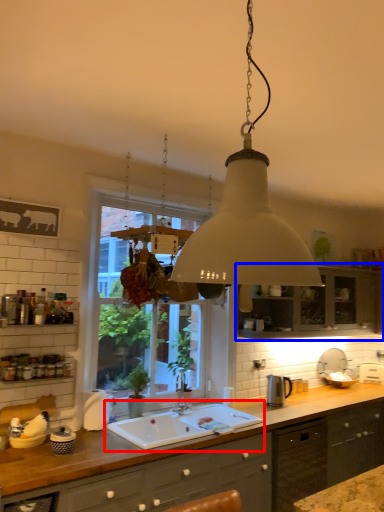
Question: Which object appears closest to the camera in this image, sink (highlighted by a red box) or cabinetry (highlighted by a blue box)?

Choices:
 (A) sink
 (B) cabinetry

Answer: (A)